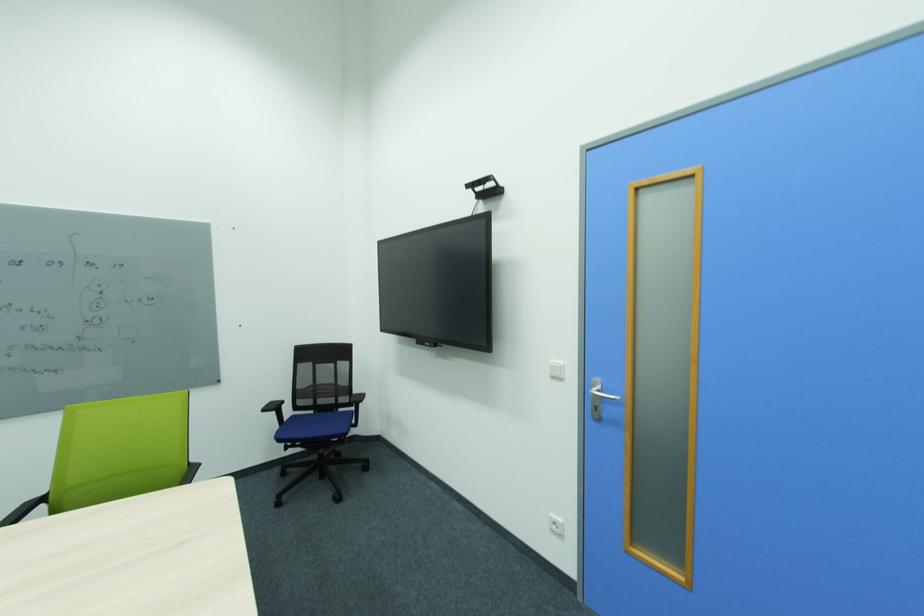
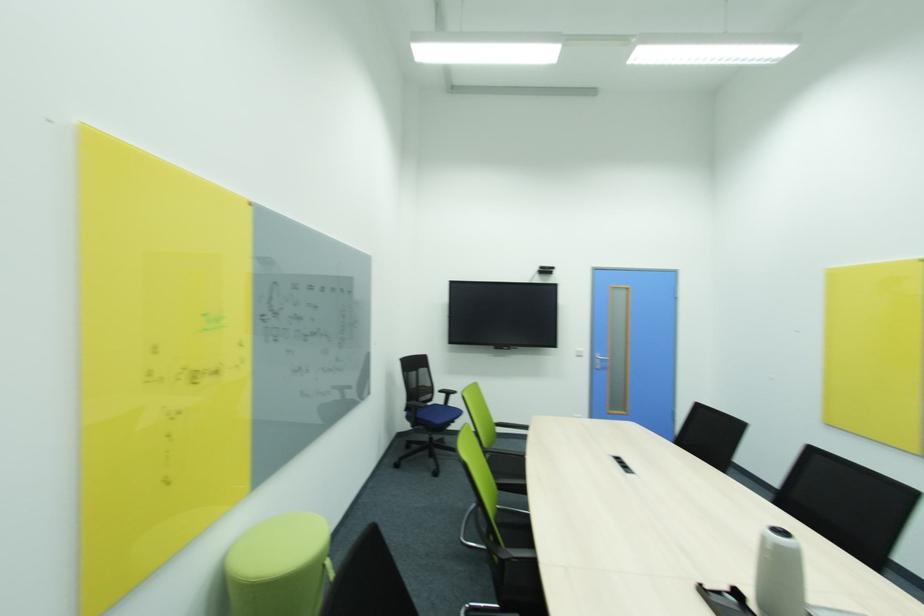
Locate, in the second image, the point that corresponds to point (347, 365) in the first image.

(428, 371)